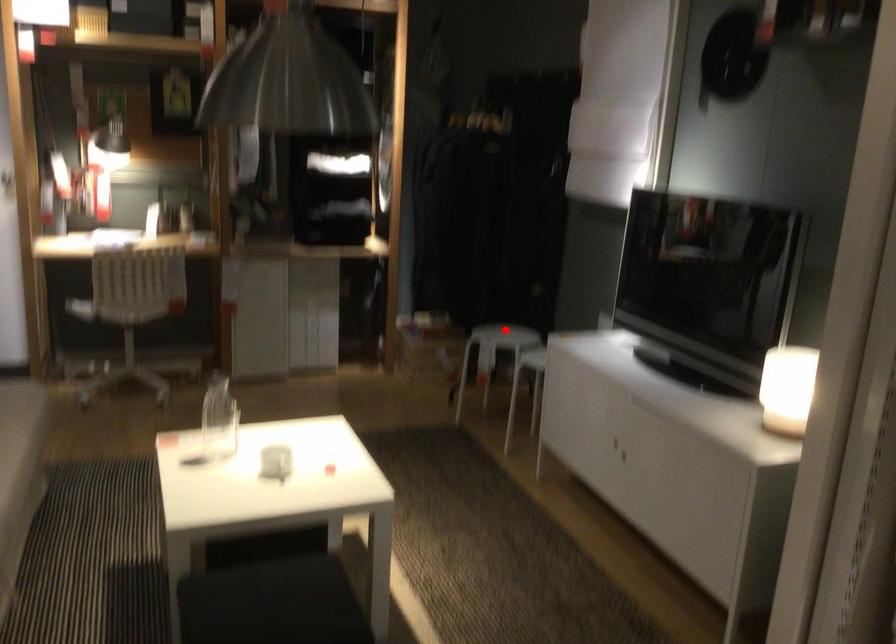
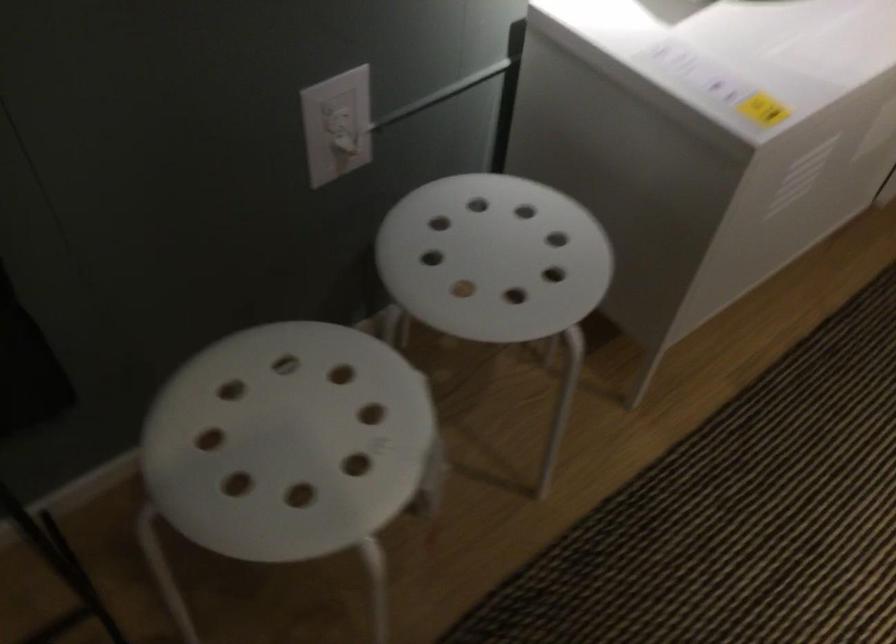
Question: I am providing you with two images of the same scene from different viewpoints. In image1, a red point is highlighted. Considering the same 3D point in image2, which of the following is correct?

Choices:
 (A) It is closer
 (B) It is farther

Answer: (A)